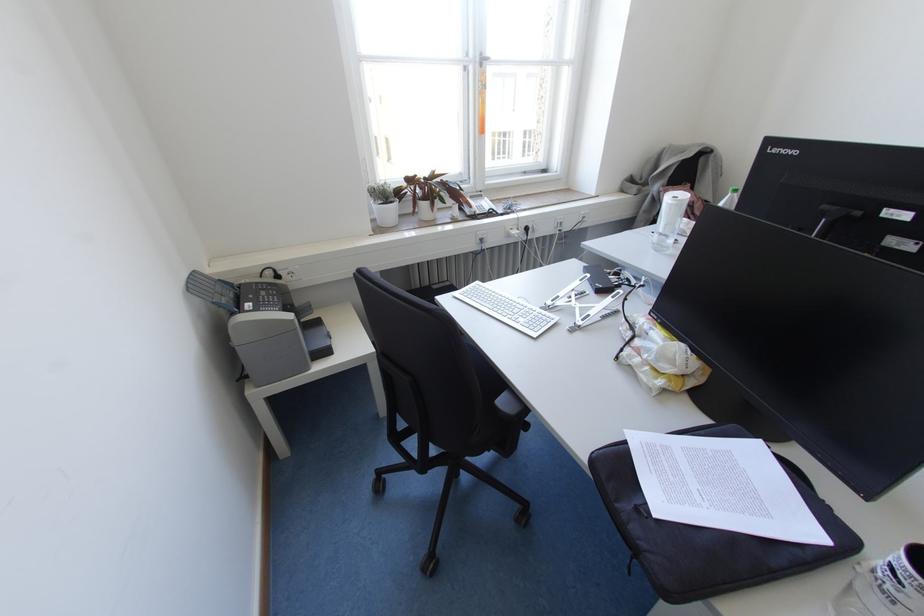
Where is `white flower pot`? The image size is (924, 616). white flower pot is located at coordinates click(383, 204).